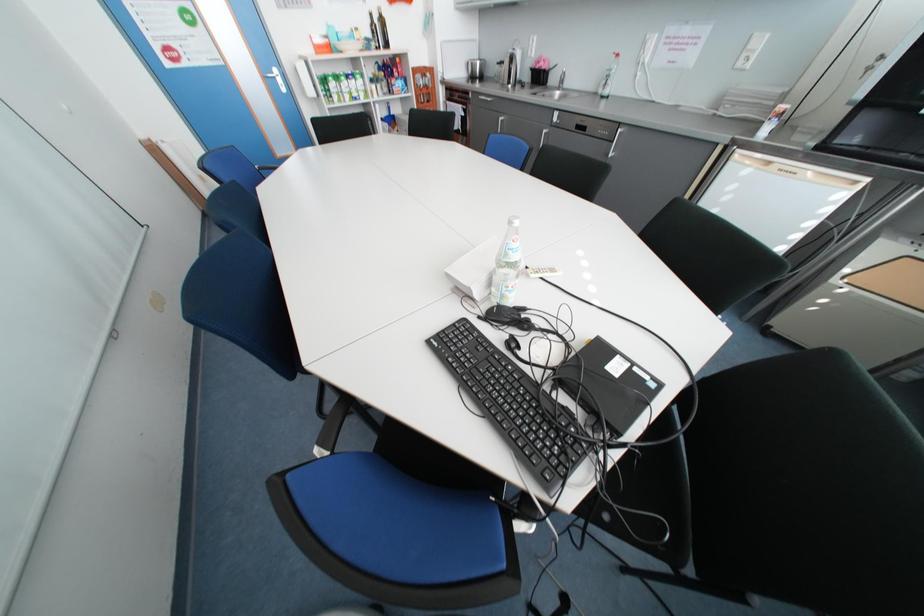
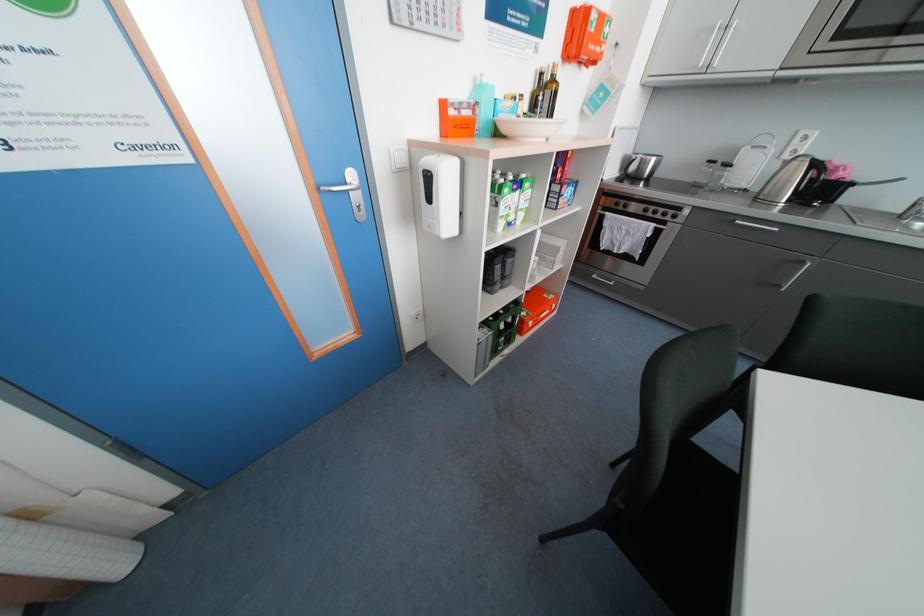
The images are taken continuously from a first-person perspective. In which direction are you moving?

The movement direction of the cameraman is left, forward.